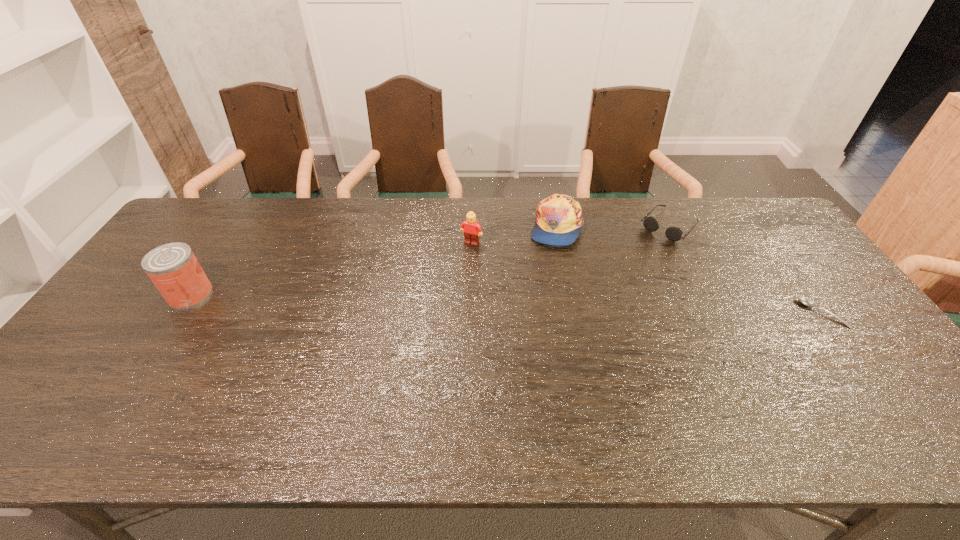
The image size is (960, 540). I want to click on free space located on the left of the shortest object, so click(775, 313).

Find the location of `free location located on the bill of the cap`. free location located on the bill of the cap is located at coordinates (579, 278).

Locate an element on the screen. This screenshot has width=960, height=540. free space located on the bill of the cap is located at coordinates (585, 290).

Find the location of a particular element. free space located on the bill of the cap is located at coordinates (571, 262).

Where is `blank area located on the front-facing side of the second shortest object`? The height and width of the screenshot is (540, 960). blank area located on the front-facing side of the second shortest object is located at coordinates (643, 253).

Locate an element on the screen. The image size is (960, 540). vacant space located 0.170m on the front-facing side of the second shortest object is located at coordinates (630, 267).

The width and height of the screenshot is (960, 540). I want to click on vacant space positioned 0.220m on the front-facing side of the second shortest object, so click(x=621, y=275).

Where is `free space located 0.250m on the face of the Lego`? This screenshot has width=960, height=540. free space located 0.250m on the face of the Lego is located at coordinates (435, 300).

Locate an element on the screen. The height and width of the screenshot is (540, 960). vacant space located on the face of the Lego is located at coordinates (432, 305).

The image size is (960, 540). Identify the location of vacant area situated on the face of the Lego. (448, 279).